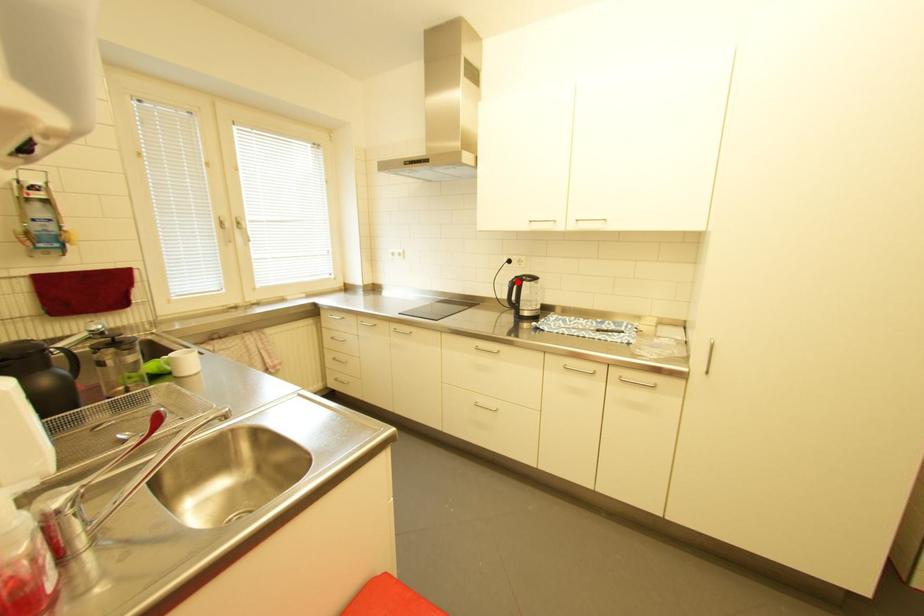
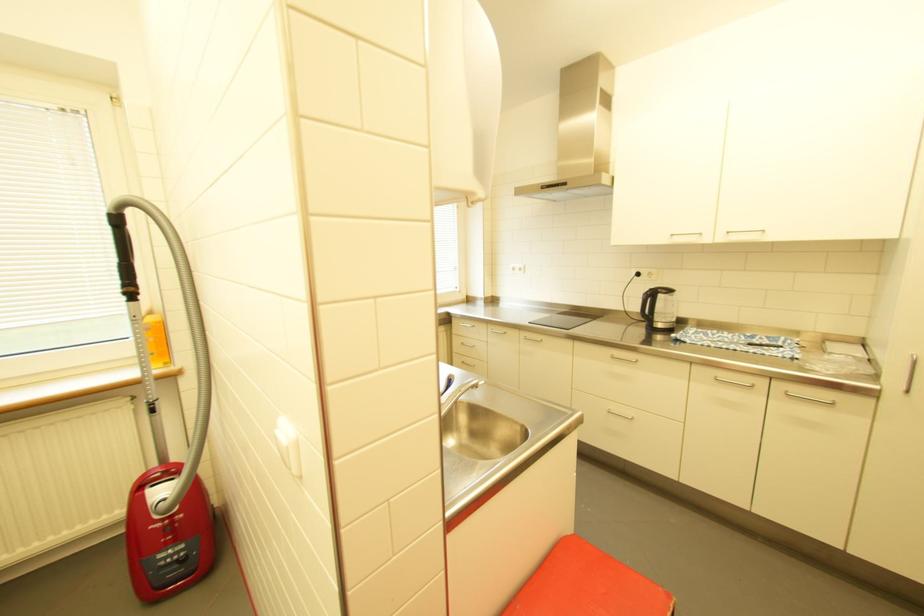
The point at the highlighted location is marked in the first image. Where is the corresponding point in the second image?

(651, 294)